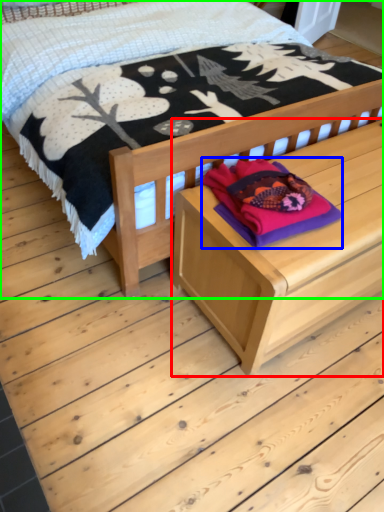
Question: Which object is positioned closest to table (highlighted by a red box)? Select from clothing (highlighted by a blue box) and bed (highlighted by a green box).

Choices:
 (A) clothing
 (B) bed

Answer: (A)